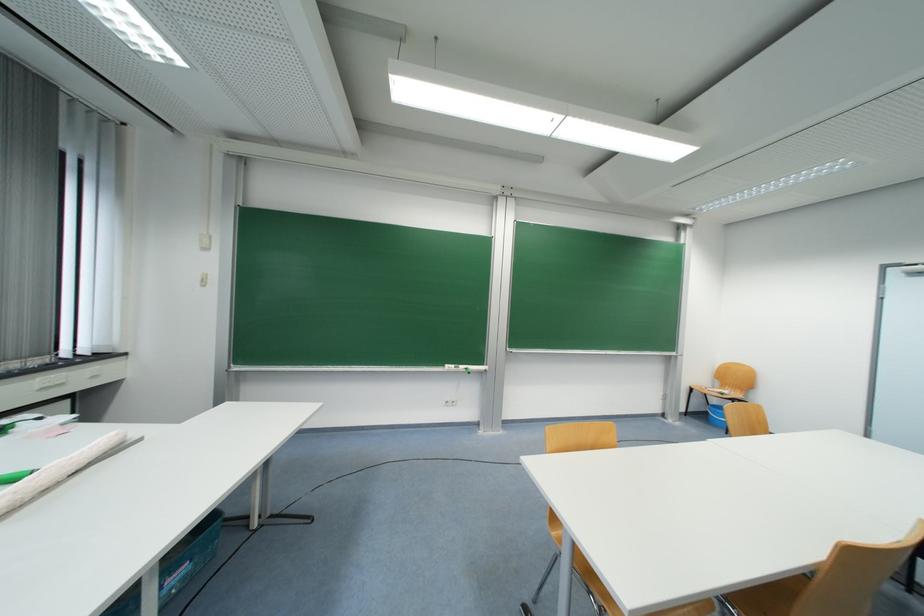
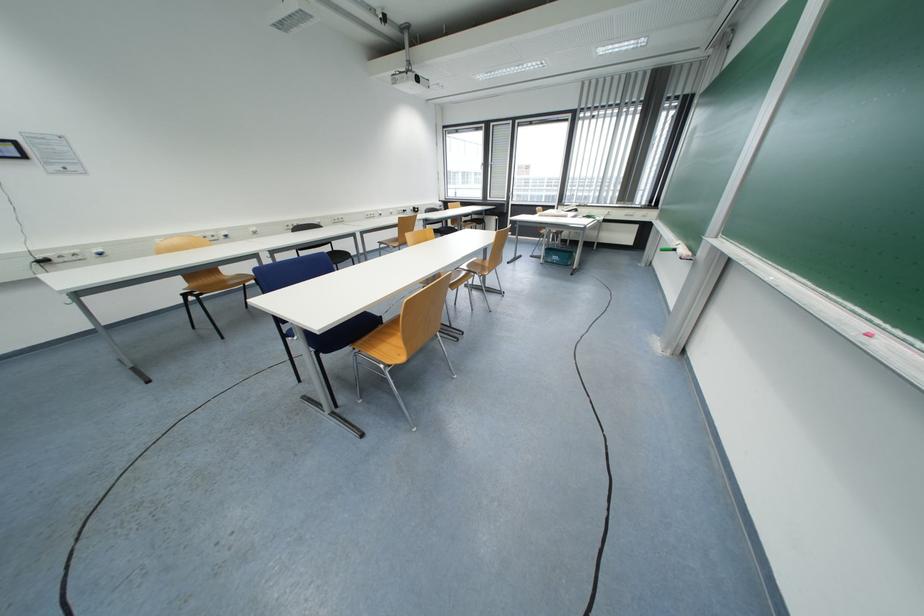
Where in the second image is the point corresponding to point (457, 368) from the first image?

(683, 244)